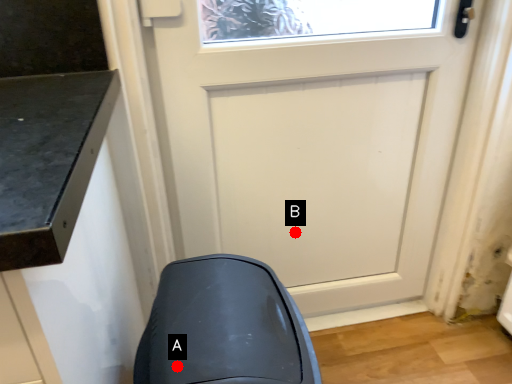
Question: Two points are circled on the image, labeled by A and B beside each circle. Which point is closer to the camera?

Choices:
 (A) A is closer
 (B) B is closer

Answer: (A)